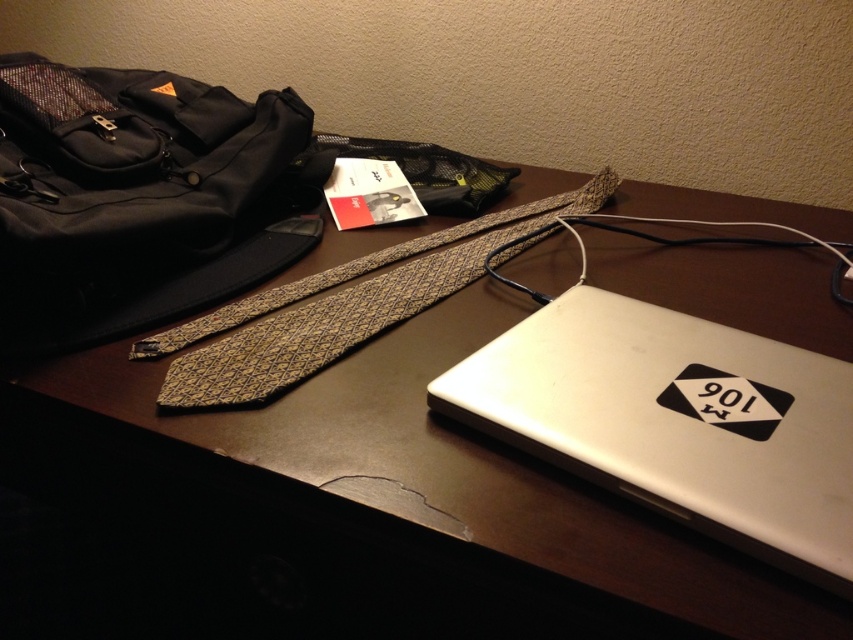
Question: Which object appears farthest from the camera in this image?

Choices:
 (A) gold textured tie at center
 (B) satin silver laptop at lower right

Answer: (A)

Question: Among these points, which one is nearest to the camera?

Choices:
 (A) (418, 272)
 (B) (815, 394)

Answer: (B)

Question: Can you confirm if satin silver laptop at lower right is positioned above gold textured tie at center?

Choices:
 (A) no
 (B) yes

Answer: (A)

Question: Can you confirm if satin silver laptop at lower right is positioned above gold textured tie at center?

Choices:
 (A) yes
 (B) no

Answer: (B)

Question: Is satin silver laptop at lower right closer to the viewer compared to gold textured tie at center?

Choices:
 (A) no
 (B) yes

Answer: (B)